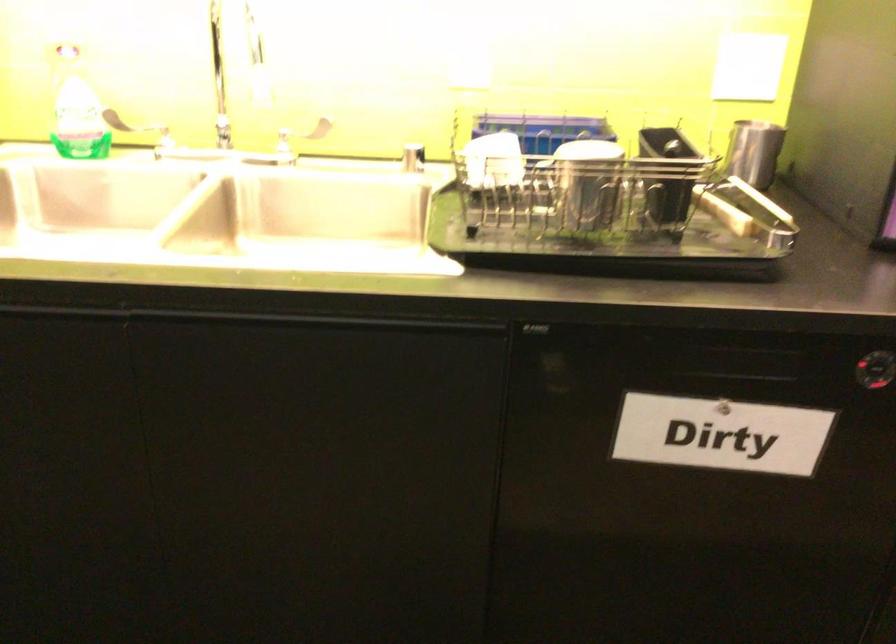
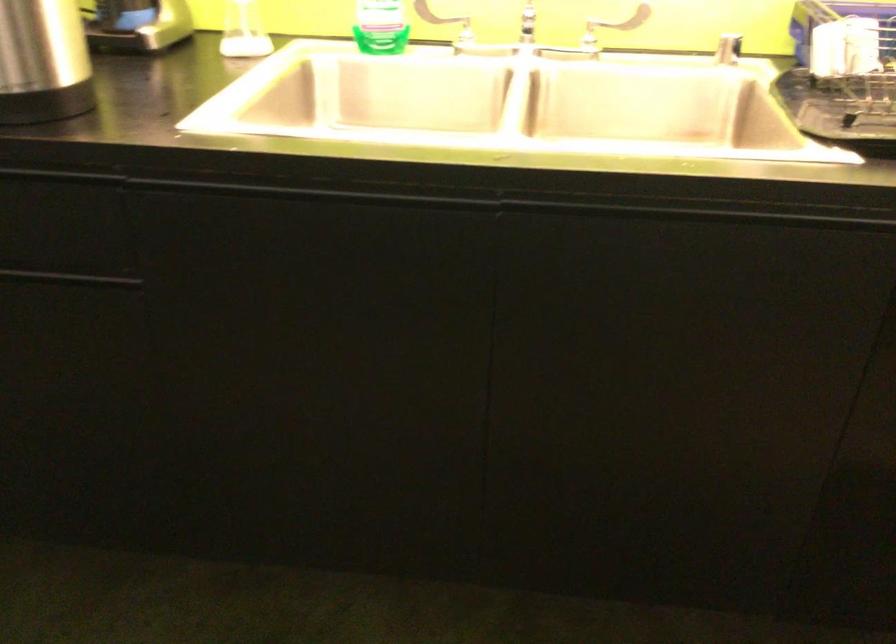
Question: The camera is either moving clockwise (left) or counter-clockwise (right) around the object. The first image is from the beginning of the video and the second image is from the end. Is the camera moving left or right when shooting the video?

Choices:
 (A) Left
 (B) Right

Answer: (B)